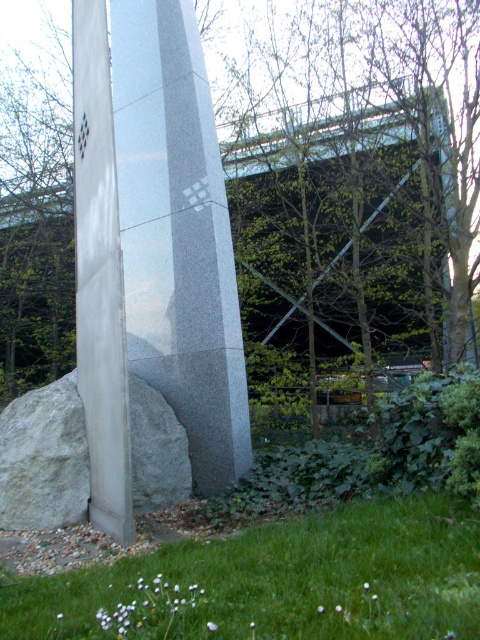
Question: In this image, where is white polished stone column at center located relative to satin gray stone pillar at center?

Choices:
 (A) right
 (B) left

Answer: (A)

Question: Does green leafy tree at center have a smaller size compared to satin gray stone pillar at center?

Choices:
 (A) no
 (B) yes

Answer: (A)

Question: Which point is farther to the camera?

Choices:
 (A) white marble rock at lower left
 (B) satin gray stone pillar at center
 (C) white polished stone column at center

Answer: (C)

Question: Which point is farther to the camera?

Choices:
 (A) (71, 632)
 (B) (202, 472)
 (C) (134, 458)

Answer: (B)

Question: Is white polished stone column at center closer to camera compared to green grass at lower center?

Choices:
 (A) yes
 (B) no

Answer: (B)

Question: Based on their relative distances, which object is farther from the green leafy tree at center?

Choices:
 (A) white marble rock at lower left
 (B) white polished stone column at center
 (C) green grass at lower center

Answer: (C)